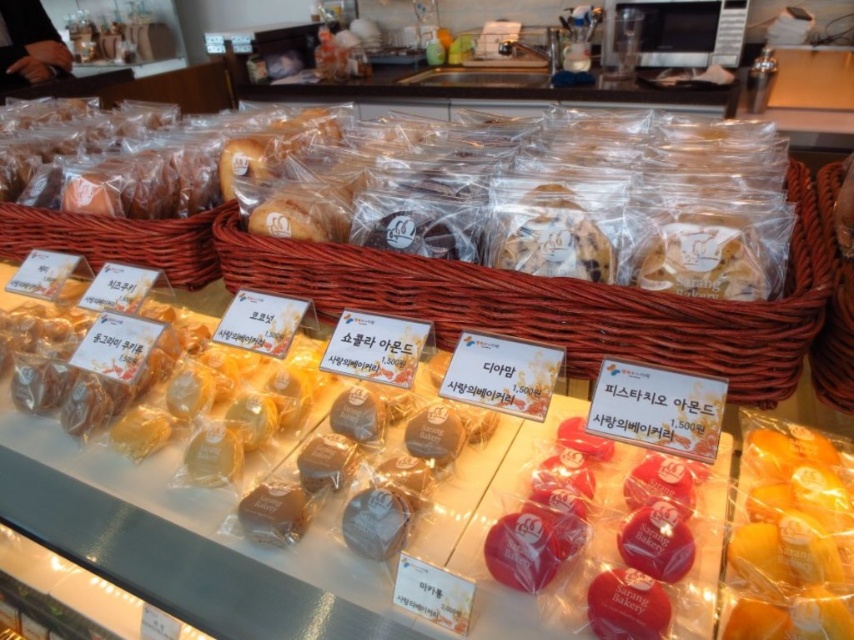
Question: Considering the relative positions of brown woven basket at upper center and brown woven basket at right in the image provided, where is brown woven basket at upper center located with respect to brown woven basket at right?

Choices:
 (A) right
 (B) left

Answer: (B)

Question: Is the position of brown woven basket at upper center more distant than that of brown woven basket at right?

Choices:
 (A) yes
 (B) no

Answer: (B)

Question: Which object is farther from the camera taking this photo?

Choices:
 (A) brown woven basket at right
 (B) brown woven basket at upper center

Answer: (A)

Question: Is brown woven basket at upper center positioned in front of brown woven basket at right?

Choices:
 (A) no
 (B) yes

Answer: (B)

Question: Which point appears closest to the camera in this image?

Choices:
 (A) (829, 221)
 (B) (459, 321)

Answer: (B)